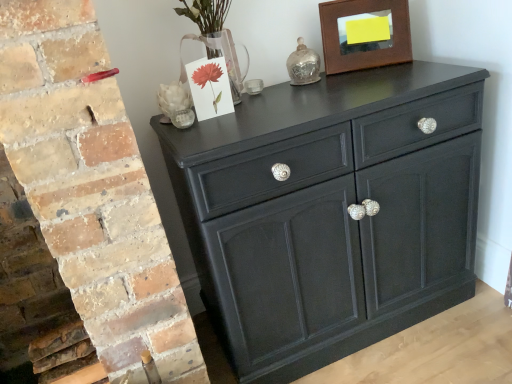
Question: From a real-world perspective, is brown wooden picture frame at upper right positioned over matte black cabinet at center based on gravity?

Choices:
 (A) yes
 (B) no

Answer: (A)

Question: Is brown wooden picture frame at upper right to the left of matte black cabinet at center from the viewer's perspective?

Choices:
 (A) yes
 (B) no

Answer: (B)

Question: From the image's perspective, is brown wooden picture frame at upper right on top of matte black cabinet at center?

Choices:
 (A) yes
 (B) no

Answer: (A)

Question: Is brown wooden picture frame at upper right not close to matte black cabinet at center?

Choices:
 (A) no
 (B) yes

Answer: (A)

Question: Does brown wooden picture frame at upper right have a lesser height compared to matte black cabinet at center?

Choices:
 (A) yes
 (B) no

Answer: (A)

Question: Based on their sizes in the image, would you say brown wooden picture frame at upper right is bigger or smaller than white matte sculpture at upper left?

Choices:
 (A) small
 (B) big

Answer: (B)

Question: From a real-world perspective, relative to white matte sculpture at upper left, is brown wooden picture frame at upper right vertically above or below?

Choices:
 (A) above
 (B) below

Answer: (A)

Question: Does point (368, 8) appear closer or farther from the camera than point (164, 112)?

Choices:
 (A) closer
 (B) farther

Answer: (B)

Question: Looking at their shapes, would you say brown wooden picture frame at upper right is wider or thinner than white matte sculpture at upper left?

Choices:
 (A) thin
 (B) wide

Answer: (A)

Question: From the image's perspective, relative to brown wooden picture frame at upper right, is white matte sculpture at upper left above or below?

Choices:
 (A) below
 (B) above

Answer: (A)

Question: Does point (173, 97) appear closer or farther from the camera than point (328, 62)?

Choices:
 (A) farther
 (B) closer

Answer: (B)

Question: In the image, is white matte sculpture at upper left positioned in front of or behind brown wooden picture frame at upper right?

Choices:
 (A) front
 (B) behind

Answer: (A)

Question: Considering the positions of white matte sculpture at upper left and brown wooden picture frame at upper right in the image, is white matte sculpture at upper left bigger or smaller than brown wooden picture frame at upper right?

Choices:
 (A) big
 (B) small

Answer: (B)

Question: Looking at the image, does white matte sculpture at upper left seem bigger or smaller compared to matte black cabinet at center?

Choices:
 (A) small
 (B) big

Answer: (A)

Question: Relative to matte black cabinet at center, is white matte sculpture at upper left in front or behind?

Choices:
 (A) front
 (B) behind

Answer: (B)